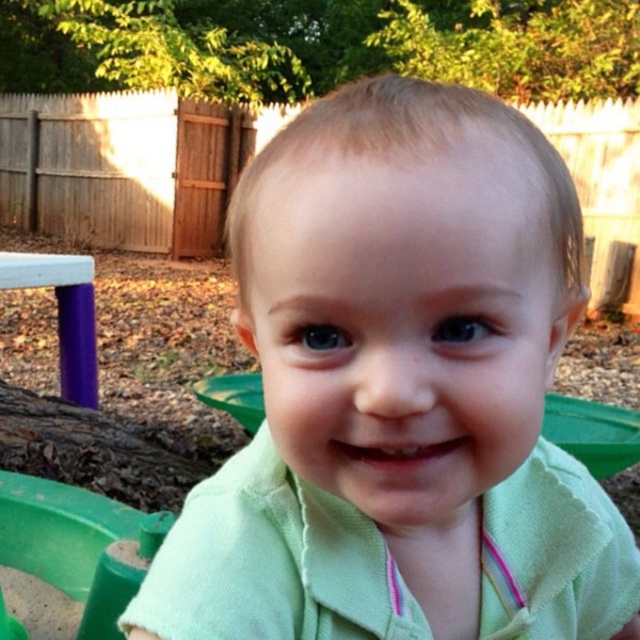
Question: Does green cotton shirt at center have a larger size compared to green plastic toy at lower left?

Choices:
 (A) no
 (B) yes

Answer: (A)

Question: Which of the following is the farthest from the observer?

Choices:
 (A) (228, 240)
 (B) (83, 634)

Answer: (A)

Question: Does green cotton shirt at center appear under green plastic toy at lower left?

Choices:
 (A) no
 (B) yes

Answer: (A)

Question: Does green cotton shirt at center appear on the right side of green plastic toy at lower left?

Choices:
 (A) no
 (B) yes

Answer: (B)